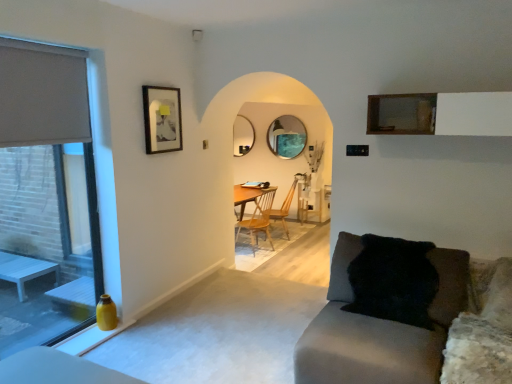
Find the location of a particular element. The image size is (512, 384). matte black picture frame at upper left is located at coordinates (162, 119).

This screenshot has width=512, height=384. I want to click on matte gray curtain at left, so click(42, 94).

Find the location of a particular element. Image resolution: width=512 pixels, height=384 pixels. wooden at center, the second chair in the back-to-front sequence is located at coordinates (259, 219).

You are a GUI agent. You are given a task and a screenshot of the screen. Output one action in this format:
    pyautogui.click(x=<x>, y=<y>)
    Task: Click on the velvet grey couch at lower right
    
    Given the screenshot: What is the action you would take?
    pyautogui.click(x=391, y=315)

Describe the element at coordinates (391, 315) in the screenshot. The image size is (512, 384). I see `velvet grey couch at lower right` at that location.

Measure the distance between black fur pillow at lower right and camera.

black fur pillow at lower right is 8.62 feet from camera.

The height and width of the screenshot is (384, 512). Find the location of `matte glass window at left`. matte glass window at left is located at coordinates (46, 197).

At what (x,y) coordinates should I click in order to perform the action: click on matte black picture frame at upper left. Please return your answer as a coordinate pair (x, y). Looking at the image, I should click on (162, 119).

Measure the distance from black fur pillow at lower right to matte black picture frame at upper left.

6.58 feet.

From the image's perspective, is black fur pillow at lower right above matte black picture frame at upper left?

Incorrect, from the image's perspective, black fur pillow at lower right is lower than matte black picture frame at upper left.

Can you confirm if black fur pillow at lower right is positioned to the left of matte black picture frame at upper left?

Incorrect, black fur pillow at lower right is not on the left side of matte black picture frame at upper left.

You are a GUI agent. You are given a task and a screenshot of the screen. Output one action in this format:
    pyautogui.click(x=<x>, y=<y>)
    Task: Click on the picture frame on the left of black fur pillow at lower right
    The image size is (512, 384).
    Given the screenshot: What is the action you would take?
    pyautogui.click(x=162, y=119)

From a real-world perspective, who is located higher, velvet grey couch at lower right or wooden chair at center, positioned as the second chair in front-to-back order?

In real-world perspective, velvet grey couch at lower right is above.

From the image's perspective, is velvet grey couch at lower right on wooden chair at center, the first chair when ordered from back to front?

No.

Consider the image. Considering the sizes of objects velvet grey couch at lower right and wooden chair at center, positioned as the second chair in front-to-back order, in the image provided, who is shorter, velvet grey couch at lower right or wooden chair at center, positioned as the second chair in front-to-back order,?

velvet grey couch at lower right is shorter.

Could you tell me if velvet grey couch at lower right is facing wooden chair at center, the first chair when ordered from back to front?

No, velvet grey couch at lower right is not turned towards wooden chair at center, the first chair when ordered from back to front.

What's the angular difference between matte glass mirror at center, which appears as the 2th mirror when viewed from the left, and matte glass window at left's facing directions?

91.1 degrees.

Does matte glass mirror at center, which appears as the 2th mirror when viewed from the left, have a smaller size compared to matte glass window at left?

Correct, matte glass mirror at center, which appears as the 2th mirror when viewed from the left, occupies less space than matte glass window at left.

Is matte glass mirror at center, which appears as the 2th mirror when viewed from the left, looking in the opposite direction of matte glass window at left?

matte glass mirror at center, which appears as the 2th mirror when viewed from the left, is not turned away from matte glass window at left.

What's the angular difference between matte glass mirror at center, which is the first mirror in right-to-left order, and black fur pillow at lower right's facing directions?

1.31 degrees.

Is matte glass mirror at center, which appears as the 2th mirror when viewed from the left, not inside black fur pillow at lower right?

That's correct, matte glass mirror at center, which appears as the 2th mirror when viewed from the left, is outside of black fur pillow at lower right.

From a real-world perspective, is matte glass mirror at center, which appears as the 2th mirror when viewed from the left, positioned over black fur pillow at lower right based on gravity?

Correct, in the physical world, matte glass mirror at center, which appears as the 2th mirror when viewed from the left, is higher than black fur pillow at lower right.

How much distance is there between matte glass mirror at center, which appears as the 2th mirror when viewed from the left, and black fur pillow at lower right?

Result: A distance of 4.11 meters exists between matte glass mirror at center, which appears as the 2th mirror when viewed from the left, and black fur pillow at lower right.

From a real-world perspective, which is physically above, matte glass window at left or velvet grey couch at lower right?

From a 3D spatial view, matte glass window at left is above.

Is matte glass window at left looking in the opposite direction of velvet grey couch at lower right?

No, matte glass window at left is not facing the opposite direction of velvet grey couch at lower right.

Between matte glass window at left and velvet grey couch at lower right, which one has larger width?

velvet grey couch at lower right is wider.

Does matte glass window at left come in front of black fur pillow at lower right?

That is True.

From their relative heights in the image, would you say matte glass window at left is taller or shorter than black fur pillow at lower right?

matte glass window at left is taller than black fur pillow at lower right.

Are matte glass window at left and black fur pillow at lower right making contact?

They are not placed beside each other.

Is there a large distance between velvet grey couch at lower right and matte silver mirror at center, acting as the second mirror starting from the right?

velvet grey couch at lower right is positioned a significant distance from matte silver mirror at center, acting as the second mirror starting from the right.

Between velvet grey couch at lower right and matte silver mirror at center, acting as the second mirror starting from the right, which one has smaller size?

Smaller between the two is matte silver mirror at center, acting as the second mirror starting from the right.

From the image's perspective, relative to matte silver mirror at center, the 1th mirror from the left, is velvet grey couch at lower right above or below?

velvet grey couch at lower right is situated lower than matte silver mirror at center, the 1th mirror from the left, in the image.

Consider the image. What's the angular difference between velvet grey couch at lower right and matte silver mirror at center, acting as the second mirror starting from the right,'s facing directions?

The facing directions of velvet grey couch at lower right and matte silver mirror at center, acting as the second mirror starting from the right, are 0.477 degrees apart.

There is a black fur pillow at lower right. Where is `picture frame above it (from a real-world perspective)`? Image resolution: width=512 pixels, height=384 pixels. picture frame above it (from a real-world perspective) is located at coordinates (162, 119).

Identify the location of studio couch that is on the right side of wooden chair at center, positioned as the second chair in front-to-back order. The height and width of the screenshot is (384, 512). (391, 315).

From the picture: Considering their positions, is matte black picture frame at upper left positioned closer to matte glass mirror at center, which is the first mirror in right-to-left order, than matte silver mirror at center, acting as the second mirror starting from the right?

matte silver mirror at center, acting as the second mirror starting from the right, is positioned closer to the anchor matte glass mirror at center, which is the first mirror in right-to-left order.

Considering their positions, is matte glass mirror at center, which is the first mirror in right-to-left order, positioned closer to matte gray curtain at left than black fur pillow at lower right?

Based on the image, black fur pillow at lower right appears to be nearer to matte gray curtain at left.

Based on the photo, estimate the real-world distances between objects in this image. Which object is further from matte glass window at left, matte silver mirror at center, the 1th mirror from the left, or matte black picture frame at upper left?

matte silver mirror at center, the 1th mirror from the left, lies further to matte glass window at left than the other object.

From the image, which object appears to be farther from matte glass window at left, wooden chair at center, the first chair when ordered from back to front, or matte black picture frame at upper left?

wooden chair at center, the first chair when ordered from back to front, lies further to matte glass window at left than the other object.

Based on their spatial positions, is matte gray curtain at left or wooden chair at center, the first chair when ordered from back to front, closer to matte black picture frame at upper left?

matte gray curtain at left is closer to matte black picture frame at upper left.

Looking at the image, which one is located closer to wooden at center, acting as the 1th chair starting from the front, matte black picture frame at upper left or black fur pillow at lower right?

matte black picture frame at upper left.

From the image, which object appears to be nearer to velvet grey couch at lower right, matte black picture frame at upper left or wooden at center, the second chair in the back-to-front sequence?

matte black picture frame at upper left.

Based on the photo, when comparing their distances from matte black picture frame at upper left, does black fur pillow at lower right or wooden at center, acting as the 1th chair starting from the front, seem closer?

Based on the image, black fur pillow at lower right appears to be nearer to matte black picture frame at upper left.

Image resolution: width=512 pixels, height=384 pixels. Identify the location of mirror located between matte glass window at left and matte silver mirror at center, acting as the second mirror starting from the right, in the depth direction. (287, 137).

Find the location of a particular element. This screenshot has height=384, width=512. window located between velvet grey couch at lower right and wooden at center, the second chair in the back-to-front sequence, in the depth direction is located at coordinates (46, 197).

The height and width of the screenshot is (384, 512). Find the location of `pillow between velvet grey couch at lower right and matte silver mirror at center, acting as the second mirror starting from the right, along the z-axis`. pillow between velvet grey couch at lower right and matte silver mirror at center, acting as the second mirror starting from the right, along the z-axis is located at coordinates (393, 280).

The height and width of the screenshot is (384, 512). I want to click on picture frame located between matte gray curtain at left and wooden chair at center, positioned as the second chair in front-to-back order, in the depth direction, so click(x=162, y=119).